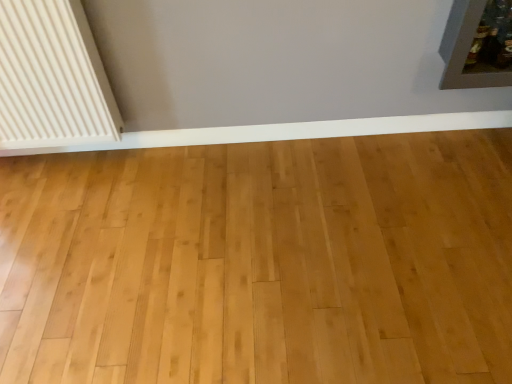
Question: Does point (256, 135) appear closer or farther from the camera than point (48, 64)?

Choices:
 (A) farther
 (B) closer

Answer: (A)

Question: From the image's perspective, is white smooth baseboard at lower center positioned above or below white ribbed radiator at left?

Choices:
 (A) below
 (B) above

Answer: (A)

Question: In terms of height, does white smooth baseboard at lower center look taller or shorter compared to white ribbed radiator at left?

Choices:
 (A) tall
 (B) short

Answer: (B)

Question: From their relative heights in the image, would you say white ribbed radiator at left is taller or shorter than white smooth baseboard at lower center?

Choices:
 (A) tall
 (B) short

Answer: (A)

Question: In the image, is white ribbed radiator at left on the left side or the right side of white smooth baseboard at lower center?

Choices:
 (A) right
 (B) left

Answer: (B)

Question: Is white ribbed radiator at left situated inside white smooth baseboard at lower center or outside?

Choices:
 (A) outside
 (B) inside

Answer: (A)

Question: Is white ribbed radiator at left wider or thinner than white smooth baseboard at lower center?

Choices:
 (A) wide
 (B) thin

Answer: (A)